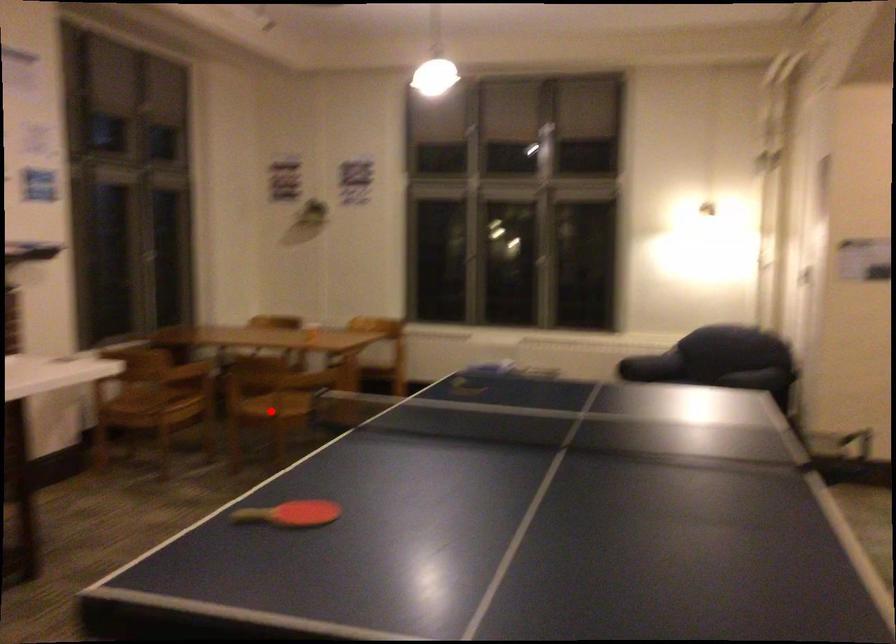
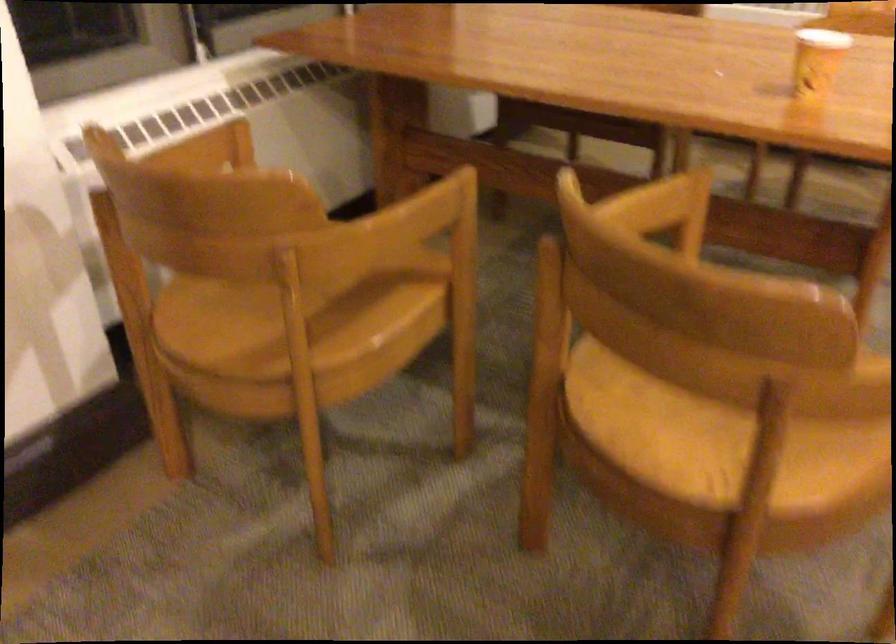
Locate, in the second image, the point that corresponds to the highlighted location in the first image.

(704, 433)